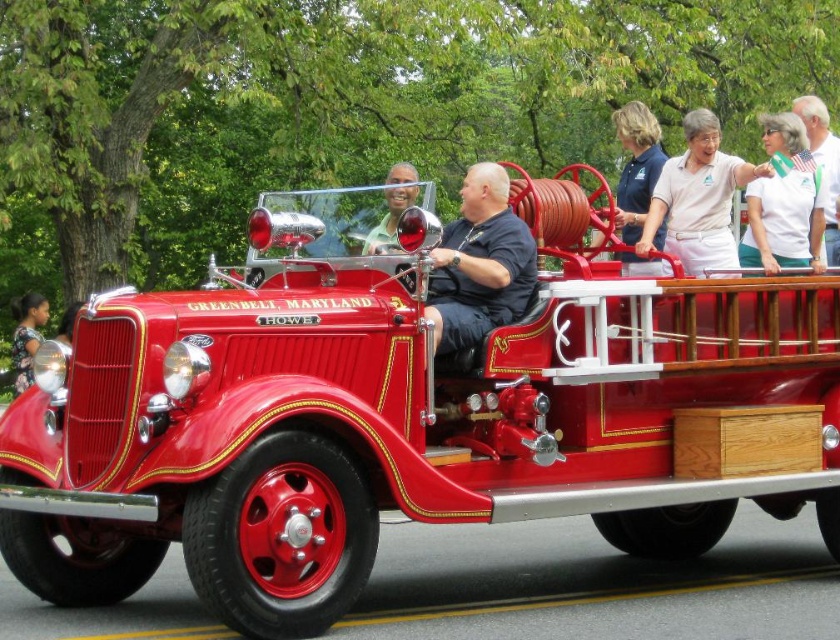
Question: Which point appears farthest from the camera in this image?

Choices:
 (A) (439, 262)
 (B) (837, 140)
 (C) (627, 168)

Answer: (C)

Question: Is matte black shirt at center above white fabric shirt at upper right?

Choices:
 (A) yes
 (B) no

Answer: (B)

Question: Is matte black shirt at center further to camera compared to printed floral dress at left?

Choices:
 (A) yes
 (B) no

Answer: (B)

Question: Where is white cotton shirt at upper center located in relation to matte green shirt at center in the image?

Choices:
 (A) right
 (B) left

Answer: (A)

Question: Which of these objects is positioned farthest from the matte green shirt at center?

Choices:
 (A) shiny red fire truck at center
 (B) matte black shirt at center
 (C) white cotton shirt at upper center

Answer: (A)

Question: Which of these objects is positioned closest to the white fabric shirt at upper right?

Choices:
 (A) white cotton shirt at upper center
 (B) matte green shirt at center
 (C) shiny red fire truck at center

Answer: (A)